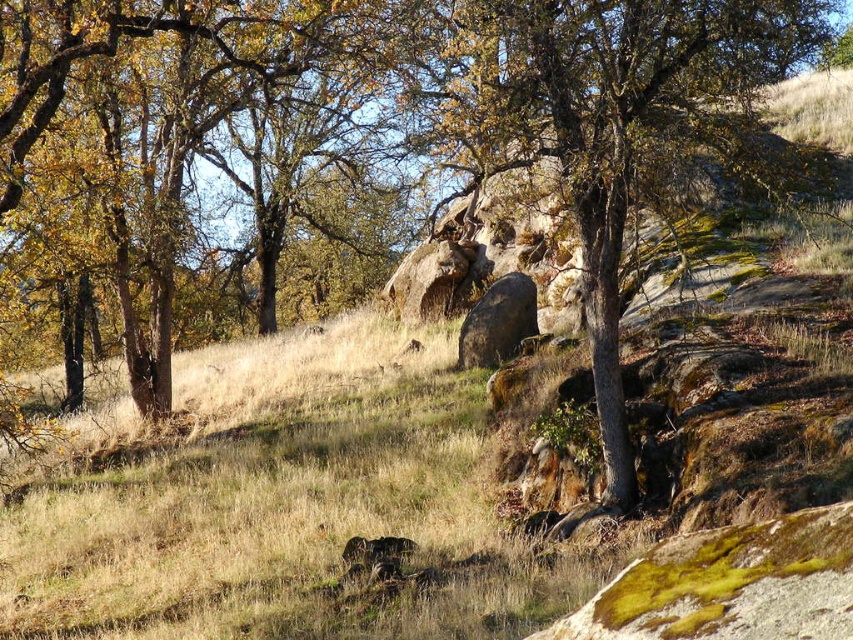
Question: Does smooth gray tree at center have a larger size compared to brown rough rock at center?

Choices:
 (A) no
 (B) yes

Answer: (B)

Question: Among these points, which one is farthest from the camera?

Choices:
 (A) (485, 332)
 (B) (595, 10)

Answer: (A)

Question: Which point is closer to the camera?

Choices:
 (A) (527, 291)
 (B) (613, 396)

Answer: (B)

Question: Which point appears farthest from the camera in this image?

Choices:
 (A) (610, 449)
 (B) (498, 332)

Answer: (B)

Question: Does smooth gray tree at center have a lesser width compared to brown rough rock at center?

Choices:
 (A) yes
 (B) no

Answer: (B)

Question: Can you confirm if smooth gray tree at center is positioned to the left of brown rough rock at center?

Choices:
 (A) yes
 (B) no

Answer: (B)